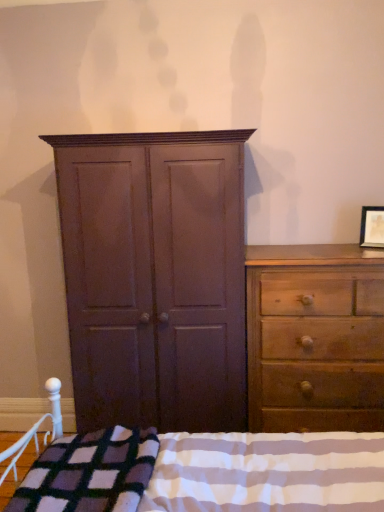
Question: From a real-world perspective, is wooden dresser at right physically above plaid wool blanket at lower center?

Choices:
 (A) yes
 (B) no

Answer: (B)

Question: Is wooden dresser at right bigger than plaid wool blanket at lower center?

Choices:
 (A) yes
 (B) no

Answer: (B)

Question: Is wooden dresser at right shorter than plaid wool blanket at lower center?

Choices:
 (A) yes
 (B) no

Answer: (B)

Question: From the image's perspective, is wooden dresser at right located beneath plaid wool blanket at lower center?

Choices:
 (A) no
 (B) yes

Answer: (A)

Question: Considering the relative sizes of wooden dresser at right and plaid wool blanket at lower center in the image provided, is wooden dresser at right thinner than plaid wool blanket at lower center?

Choices:
 (A) yes
 (B) no

Answer: (A)

Question: Considering the positions of plaid wool blanket at lower center and matte brown cupboard at center in the image, is plaid wool blanket at lower center wider or thinner than matte brown cupboard at center?

Choices:
 (A) wide
 (B) thin

Answer: (A)

Question: Relative to matte brown cupboard at center, is plaid wool blanket at lower center in front or behind?

Choices:
 (A) behind
 (B) front

Answer: (B)

Question: In the image, is plaid wool blanket at lower center on the left side or the right side of matte brown cupboard at center?

Choices:
 (A) left
 (B) right

Answer: (B)

Question: From a real-world perspective, relative to matte brown cupboard at center, is plaid wool blanket at lower center vertically above or below?

Choices:
 (A) below
 (B) above

Answer: (A)

Question: In terms of width, does plaid wool blanket at lower center look wider or thinner when compared to plush purple blanket at lower left?

Choices:
 (A) thin
 (B) wide

Answer: (B)

Question: Based on their sizes in the image, would you say plaid wool blanket at lower center is bigger or smaller than plush purple blanket at lower left?

Choices:
 (A) big
 (B) small

Answer: (A)

Question: From their relative heights in the image, would you say plaid wool blanket at lower center is taller or shorter than plush purple blanket at lower left?

Choices:
 (A) short
 (B) tall

Answer: (B)

Question: Based on their positions, is plaid wool blanket at lower center located to the left or right of plush purple blanket at lower left?

Choices:
 (A) left
 (B) right

Answer: (B)

Question: In terms of width, does matte wooden picture frame at upper right look wider or thinner when compared to plaid wool blanket at lower center?

Choices:
 (A) wide
 (B) thin

Answer: (B)

Question: Based on their positions, is matte wooden picture frame at upper right located to the left or right of plaid wool blanket at lower center?

Choices:
 (A) right
 (B) left

Answer: (A)